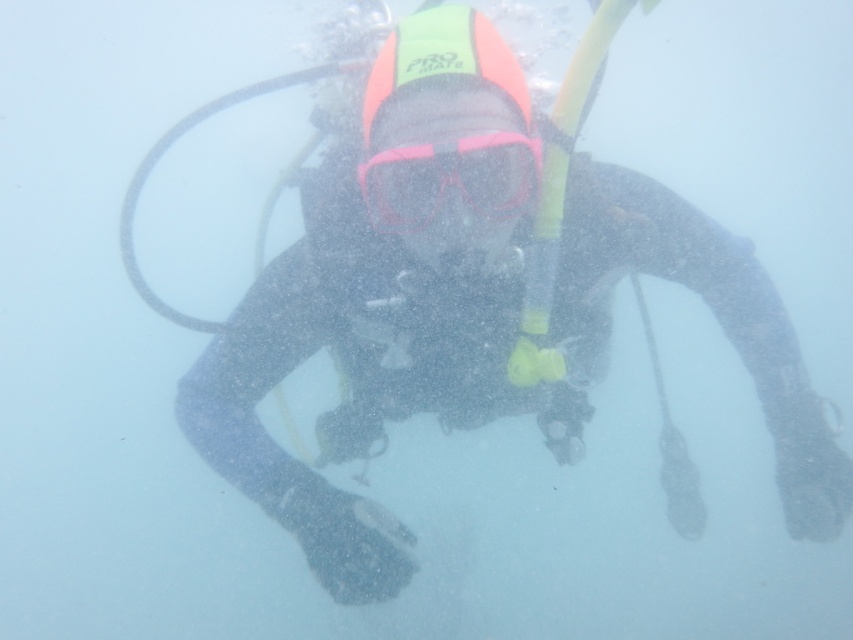
Is black matte wetsuit at center positioned in front of pink matte/glossy goggles at center?

No.

Where is `black matte wetsuit at center`? The height and width of the screenshot is (640, 853). black matte wetsuit at center is located at coordinates (471, 301).

Find the location of a particular element. black matte wetsuit at center is located at coordinates (471, 301).